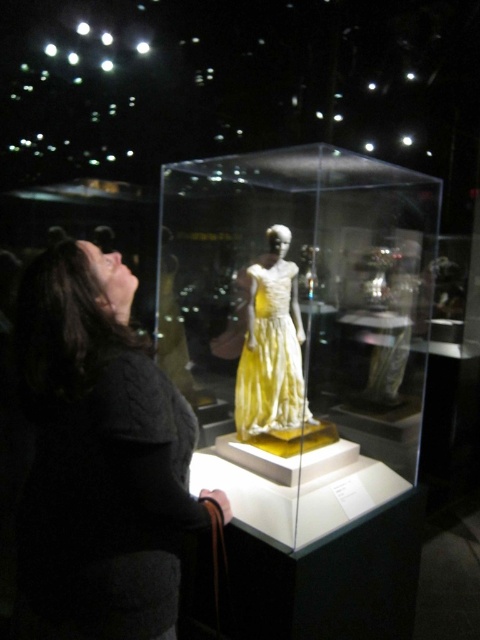
Question: Estimate the real-world distances between objects in this image. Which object is farther from the transparent glass box at center?

Choices:
 (A) dark gray sweater at lower left
 (B) yellow satin dress at center

Answer: (A)

Question: Which object appears closest to the camera in this image?

Choices:
 (A) yellow satin dress at center
 (B) dark gray sweater at lower left

Answer: (B)

Question: Is dark gray sweater at lower left to the right of yellow satin dress at center from the viewer's perspective?

Choices:
 (A) yes
 (B) no

Answer: (B)

Question: Can you confirm if dark gray sweater at lower left is thinner than yellow satin dress at center?

Choices:
 (A) yes
 (B) no

Answer: (B)

Question: Considering the relative positions of dark gray sweater at lower left and yellow satin dress at center in the image provided, where is dark gray sweater at lower left located with respect to yellow satin dress at center?

Choices:
 (A) above
 (B) below

Answer: (B)

Question: Which object appears closest to the camera in this image?

Choices:
 (A) transparent glass box at center
 (B) yellow satin dress at center
 (C) dark gray sweater at lower left

Answer: (C)